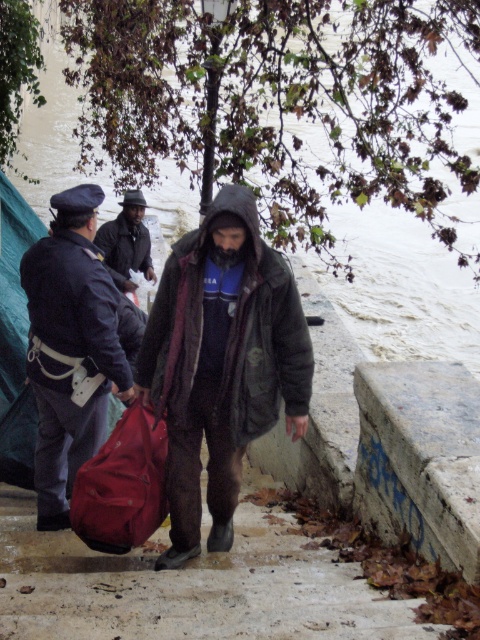
Who is higher up, dark brown fur coat at center or matte black jacket at center?

matte black jacket at center

Does point (277, 292) come farther from viewer compared to point (54, 227)?

That is False.

Image resolution: width=480 pixels, height=640 pixels. In order to click on dark brown fur coat at center in this screenshot , I will do `click(222, 362)`.

Describe the element at coordinates (72, 348) in the screenshot. I see `matte black jacket at center` at that location.

Is point (66, 221) closer to camera compared to point (129, 202)?

Yes, it is.

You are a GUI agent. You are given a task and a screenshot of the screen. Output one action in this format:
    pyautogui.click(x=<x>, y=<y>)
    Task: Click on the matte black jacket at center
    The width and height of the screenshot is (480, 640).
    Given the screenshot: What is the action you would take?
    pyautogui.click(x=72, y=348)

This screenshot has height=640, width=480. Describe the element at coordinates (72, 348) in the screenshot. I see `matte black jacket at center` at that location.

Does matte black jacket at center have a greater height compared to green fabric tent at left?

No, matte black jacket at center is not taller than green fabric tent at left.

Does point (121, 392) come farther from viewer compared to point (10, 440)?

No, it is in front of (10, 440).

Identify the location of matte black jacket at center. The width and height of the screenshot is (480, 640). (72, 348).